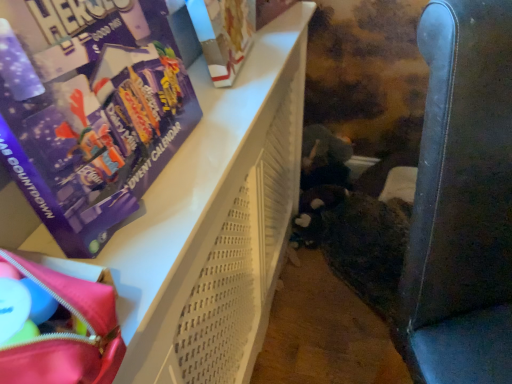
Question: Is purple cardboard advent calendar at upper left inside leather-like dark blue armchair at right?

Choices:
 (A) no
 (B) yes

Answer: (A)

Question: Is leather-like dark blue armchair at right far from purple cardboard advent calendar at upper left?

Choices:
 (A) yes
 (B) no

Answer: (B)

Question: Is leather-like dark blue armchair at right wider than purple cardboard advent calendar at upper left?

Choices:
 (A) yes
 (B) no

Answer: (A)

Question: Considering the relative positions of leather-like dark blue armchair at right and purple cardboard advent calendar at upper left in the image provided, is leather-like dark blue armchair at right in front of purple cardboard advent calendar at upper left?

Choices:
 (A) yes
 (B) no

Answer: (B)

Question: From the image's perspective, is leather-like dark blue armchair at right over purple cardboard advent calendar at upper left?

Choices:
 (A) no
 (B) yes

Answer: (A)

Question: From a real-world perspective, is leather-like dark blue armchair at right on purple cardboard advent calendar at upper left?

Choices:
 (A) no
 (B) yes

Answer: (A)

Question: From the image's perspective, is leather-like dark blue armchair at right on white cardboard book at upper center?

Choices:
 (A) yes
 (B) no

Answer: (B)

Question: From the image's perspective, would you say leather-like dark blue armchair at right is shown under white cardboard book at upper center?

Choices:
 (A) no
 (B) yes

Answer: (B)

Question: From a real-world perspective, does leather-like dark blue armchair at right stand above white cardboard book at upper center?

Choices:
 (A) yes
 (B) no

Answer: (B)

Question: Is leather-like dark blue armchair at right turned away from white cardboard book at upper center?

Choices:
 (A) yes
 (B) no

Answer: (B)

Question: Is leather-like dark blue armchair at right completely or partially outside of white cardboard book at upper center?

Choices:
 (A) no
 (B) yes

Answer: (B)

Question: Is leather-like dark blue armchair at right wider than white cardboard book at upper center?

Choices:
 (A) no
 (B) yes

Answer: (B)

Question: From a real-world perspective, is white perforated plastic basket at upper left located beneath matte pink fabric bag at lower left?

Choices:
 (A) yes
 (B) no

Answer: (A)